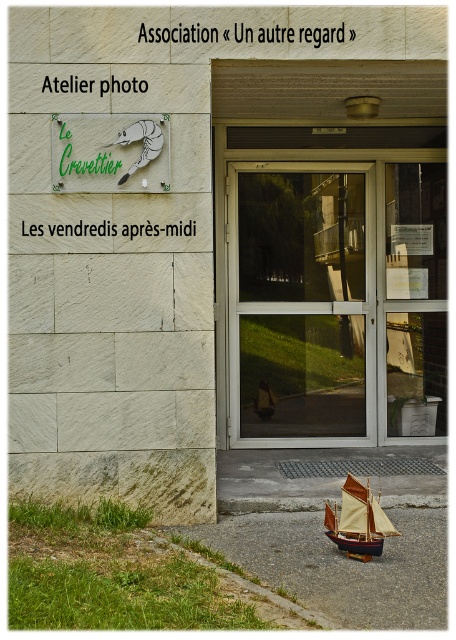
Who is higher up, green painted sign at upper left or wooden sailboat at lower right?

green painted sign at upper left

Between point (127, 168) and point (383, 516), which one is positioned behind?

The point (127, 168) is behind.

Image resolution: width=456 pixels, height=640 pixels. Find the location of `green painted sign at upper left`. green painted sign at upper left is located at coordinates (109, 152).

Measure the distance between transparent glass door at center and green painted sign at upper left.

The distance of transparent glass door at center from green painted sign at upper left is 2.02 meters.

Which of these two, transparent glass door at center or green painted sign at upper left, stands taller?

transparent glass door at center is taller.

Who is more forward, (352, 269) or (114, 161)?

Point (114, 161) is more forward.

This screenshot has height=640, width=456. Find the location of `transparent glass door at center`. transparent glass door at center is located at coordinates (300, 305).

Who is lower down, green painted sign at upper left or matte silver shrimp at upper left?

green painted sign at upper left is below.

Between green painted sign at upper left and matte silver shrimp at upper left, which one has more height?

green painted sign at upper left is taller.

Does point (155, 163) come in front of point (122, 179)?

No.

Find the location of a particular element. green painted sign at upper left is located at coordinates [x=109, y=152].